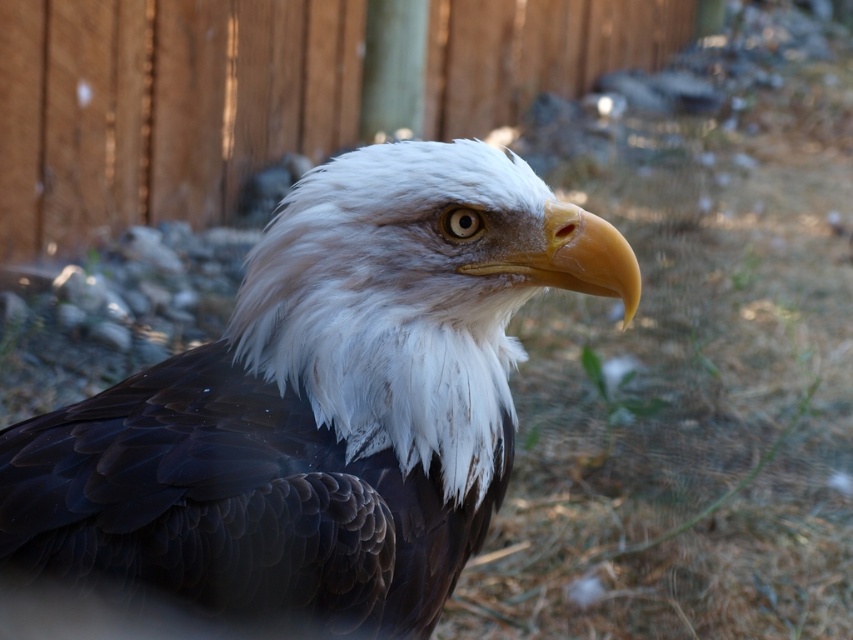
You are a photographer aiming to capture the bald eagle in the image. You want to ensure the yellow glossy beak at center is clearly visible in your photo. Based on their positions, will the wooden fence at upper center block the view of the beak?

The wooden fence at upper center is above the yellow glossy beak at center, so it might partially block the view of the beak depending on the camera angle and zoom. To ensure the beak is clearly visible, adjust your position or zoom in to frame the beak without the fence obstructing it.

You are a photographer trying to capture the bald eagle. You notice the wooden fence at upper center and the yellow glossy beak at center. Which object is closer to your camera lens?

The wooden fence at upper center is closer to the camera lens because it is further to the viewer than the yellow glossy beak at center.

You are a photographer adjusting your camera settings to focus on two points in the image of the bald eagle. The first point is at coordinates point (218, 573) and the second point is at point (194, 195). Which point should you focus on first if you want to capture the closest point to the viewer?

Point (218, 573) is closer to the viewer than point (194, 195), so you should focus on point (218, 573) first to capture the closest point.